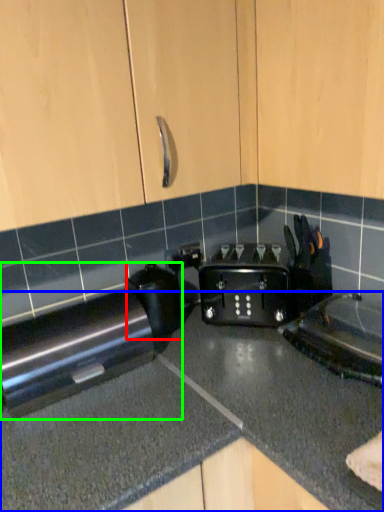
Question: Which is nearer to the appliance (highlighted by a red box)? countertop (highlighted by a blue box) or home appliance (highlighted by a green box).

Choices:
 (A) countertop
 (B) home appliance

Answer: (B)